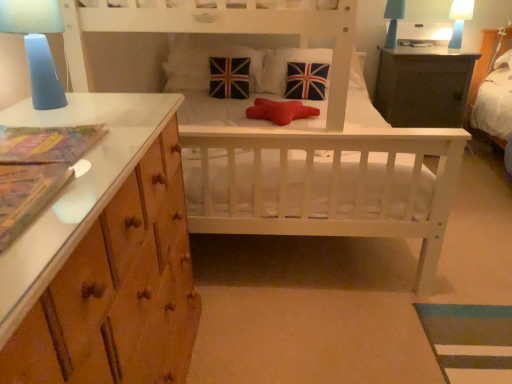
Question: Considering the relative sizes of dark gray wooden table at upper right and blue frosted glass lamp at upper left, which ranks as the 1th bedside lamp in front-to-back order, in the image provided, is dark gray wooden table at upper right smaller than blue frosted glass lamp at upper left, which ranks as the 1th bedside lamp in front-to-back order,?

Choices:
 (A) no
 (B) yes

Answer: (A)

Question: Can you confirm if dark gray wooden table at upper right is taller than blue frosted glass lamp at upper left, which ranks as the 1th bedside lamp in front-to-back order?

Choices:
 (A) no
 (B) yes

Answer: (B)

Question: Is the surface of dark gray wooden table at upper right in direct contact with blue frosted glass lamp at upper left, positioned as the 1th bedside lamp in left-to-right order?

Choices:
 (A) yes
 (B) no

Answer: (B)

Question: Is dark gray wooden table at upper right at the right side of blue frosted glass lamp at upper left, positioned as the first bedside lamp in bottom-to-top order?

Choices:
 (A) yes
 (B) no

Answer: (A)

Question: From a real-world perspective, is dark gray wooden table at upper right on blue frosted glass lamp at upper left, which ranks as the 1th bedside lamp in front-to-back order?

Choices:
 (A) no
 (B) yes

Answer: (A)

Question: Considering the positions of union jack fabric pillow at center, which is the first pillow from right to left, and blue frosted glass lamp at upper left, positioned as the 1th bedside lamp in left-to-right order, in the image, is union jack fabric pillow at center, which is the first pillow from right to left, wider or thinner than blue frosted glass lamp at upper left, positioned as the 1th bedside lamp in left-to-right order,?

Choices:
 (A) thin
 (B) wide

Answer: (B)

Question: Considering the positions of union jack fabric pillow at center, which is the first pillow from right to left, and blue frosted glass lamp at upper left, the 3th bedside lamp in the back-to-front sequence, in the image, is union jack fabric pillow at center, which is the first pillow from right to left, bigger or smaller than blue frosted glass lamp at upper left, the 3th bedside lamp in the back-to-front sequence,?

Choices:
 (A) big
 (B) small

Answer: (A)

Question: From the image's perspective, is union jack fabric pillow at center, which appears as the 4th pillow when viewed from the left, above or below blue frosted glass lamp at upper left, positioned as the first bedside lamp in bottom-to-top order?

Choices:
 (A) below
 (B) above

Answer: (B)

Question: Is union jack fabric pillow at center, which appears as the 4th pillow when viewed from the left, inside the boundaries of blue frosted glass lamp at upper left, positioned as the 1th bedside lamp in left-to-right order, or outside?

Choices:
 (A) outside
 (B) inside

Answer: (A)

Question: In the image, is velvet union jack pillow at center, which is counted as the fourth pillow, starting from the right, on the left side or the right side of dark gray wooden table at upper right?

Choices:
 (A) right
 (B) left

Answer: (B)

Question: Looking at their shapes, would you say velvet union jack pillow at center, which is counted as the fourth pillow, starting from the right, is wider or thinner than dark gray wooden table at upper right?

Choices:
 (A) wide
 (B) thin

Answer: (B)

Question: Considering the positions of velvet union jack pillow at center, which appears as the 1th pillow when viewed from the left, and dark gray wooden table at upper right in the image, is velvet union jack pillow at center, which appears as the 1th pillow when viewed from the left, taller or shorter than dark gray wooden table at upper right?

Choices:
 (A) tall
 (B) short

Answer: (B)

Question: Do you think velvet union jack pillow at center, which appears as the 1th pillow when viewed from the left, is within dark gray wooden table at upper right, or outside of it?

Choices:
 (A) inside
 (B) outside

Answer: (B)

Question: Is white wooden crib at center in front of or behind velvet union jack pillow at center, which is counted as the third pillow, starting from the right, in the image?

Choices:
 (A) front
 (B) behind

Answer: (A)

Question: From a real-world perspective, is white wooden crib at center above or below velvet union jack pillow at center, which is counted as the third pillow, starting from the right?

Choices:
 (A) below
 (B) above

Answer: (A)